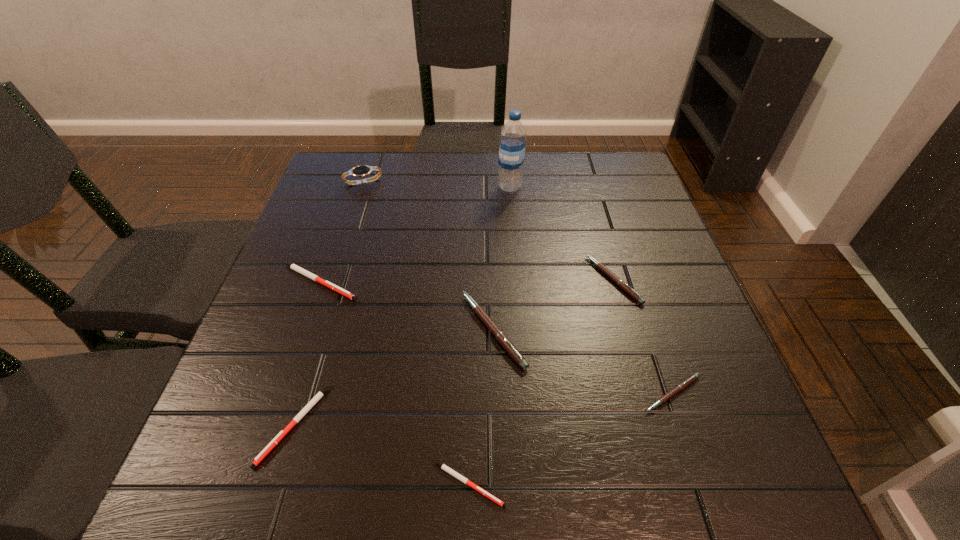
The height and width of the screenshot is (540, 960). I want to click on the rightmost white pen, so click(442, 466).

Where is `the shortest object`? the shortest object is located at coordinates (442, 466).

Locate an element on the screen. The width and height of the screenshot is (960, 540). blank space located on the label of the water bottle is located at coordinates (472, 187).

Locate an element on the screen. The image size is (960, 540). free space located on the label of the water bottle is located at coordinates (444, 187).

Locate an element on the screen. free space located 0.320m on the label of the water bottle is located at coordinates (384, 187).

You are a GUI agent. You are given a task and a screenshot of the screen. Output one action in this format:
    pyautogui.click(x=<x>, y=<y>)
    Task: Click on the vacant region located on the back of the black watch
    The image size is (960, 540).
    Given the screenshot: What is the action you would take?
    pyautogui.click(x=372, y=156)

Locate an element on the screen. free space located 0.090m at the nib of the sixth shortest object is located at coordinates (418, 330).

You are a GUI agent. You are given a task and a screenshot of the screen. Output one action in this format:
    pyautogui.click(x=<x>, y=<y>)
    Task: Click on the vacant space located at the nib of the sixth shortest object
    The height and width of the screenshot is (540, 960).
    Given the screenshot: What is the action you would take?
    pyautogui.click(x=284, y=330)

I want to click on vacant area situated 0.160m at the nib of the sixth shortest object, so click(383, 330).

You are a GUI agent. You are given a task and a screenshot of the screen. Output one action in this format:
    pyautogui.click(x=<x>, y=<y>)
    Task: Click on the free space located 0.370m at the nib of the second biggest pink pen
    
    Given the screenshot: What is the action you would take?
    pyautogui.click(x=426, y=280)